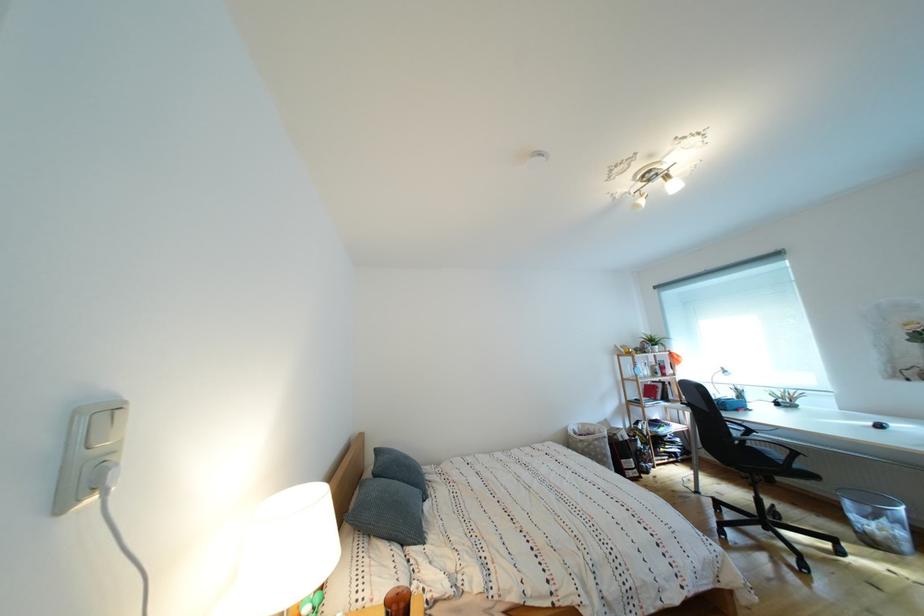
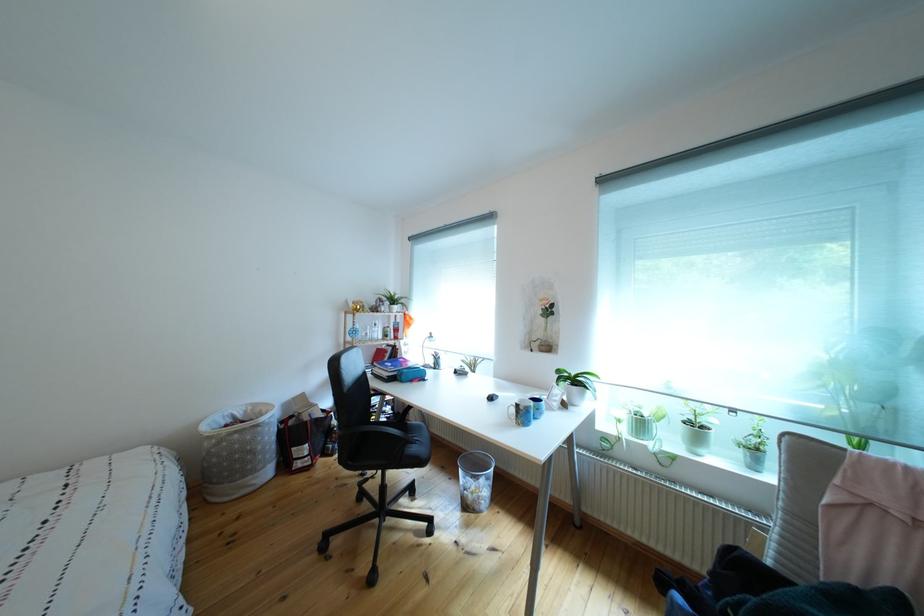
Locate, in the second image, the point that corresponds to (x=657, y=383) in the first image.

(383, 345)